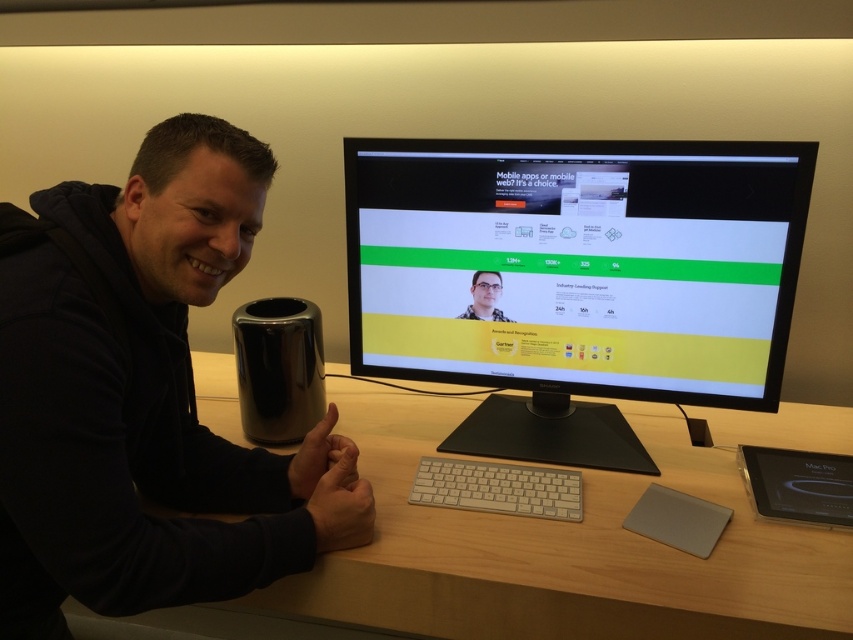
Question: Which object appears farthest from the camera in this image?

Choices:
 (A) glossy black mug at center
 (B) matte black monitor at center
 (C) white matte keyboard at center
 (D) black matte speaker at left

Answer: (A)

Question: Is glossy black mug at center to the left of matte black monitor at center from the viewer's perspective?

Choices:
 (A) yes
 (B) no

Answer: (A)

Question: Which is nearer to the wooden at center?

Choices:
 (A) white matte keyboard at center
 (B) black matte speaker at left
 (C) glossy black mug at center
 (D) matte black monitor at center

Answer: (A)

Question: Does black glossy monitor at center appear on the right side of wooden at center?

Choices:
 (A) yes
 (B) no

Answer: (A)

Question: Estimate the real-world distances between objects in this image. Which object is farther from the glossy black mug at center?

Choices:
 (A) black glossy monitor at center
 (B) black matte speaker at left
 (C) wooden at center

Answer: (A)

Question: Considering the relative positions of glossy black mug at center and matte black monitor at center in the image provided, where is glossy black mug at center located with respect to matte black monitor at center?

Choices:
 (A) left
 (B) right

Answer: (A)